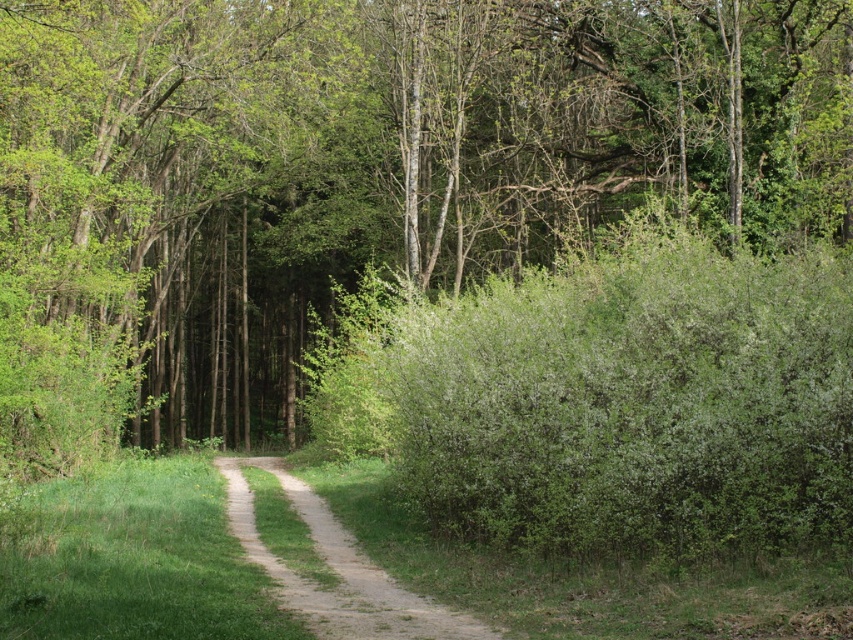
Question: Does green leafy bush at right have a larger size compared to dirt path at center?

Choices:
 (A) no
 (B) yes

Answer: (B)

Question: Which of the following is the farthest from the observer?

Choices:
 (A) (445, 416)
 (B) (405, 618)

Answer: (A)

Question: Observing the image, what is the correct spatial positioning of green leafy bush at right in reference to dirt path at center?

Choices:
 (A) above
 (B) below

Answer: (A)

Question: Is the position of green leafy bush at right more distant than that of dirt path at center?

Choices:
 (A) no
 (B) yes

Answer: (B)